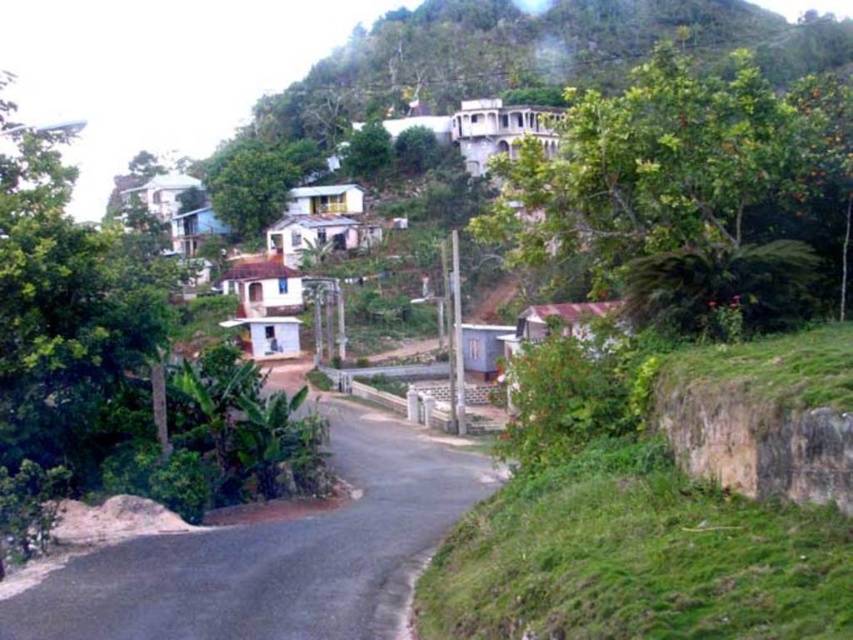
What do you see at coordinates (117, 365) in the screenshot? The width and height of the screenshot is (853, 640). I see `green leafy tree at left` at bounding box center [117, 365].

Is green leafy tree at left thinner than green leafy tree at center?

No.

Where is `green leafy tree at left`? green leafy tree at left is located at coordinates (117, 365).

Between asphalt road at center and green leafy tree at center, which one appears on the right side from the viewer's perspective?

asphalt road at center

Can you confirm if asphalt road at center is positioned below green leafy tree at center?

Correct, asphalt road at center is located below green leafy tree at center.

Where is `asphalt road at center`? Image resolution: width=853 pixels, height=640 pixels. asphalt road at center is located at coordinates (276, 554).

Can you confirm if green leafy tree at left is positioned below asphalt road at center?

Incorrect, green leafy tree at left is not positioned below asphalt road at center.

The height and width of the screenshot is (640, 853). I want to click on green leafy tree at left, so click(117, 365).